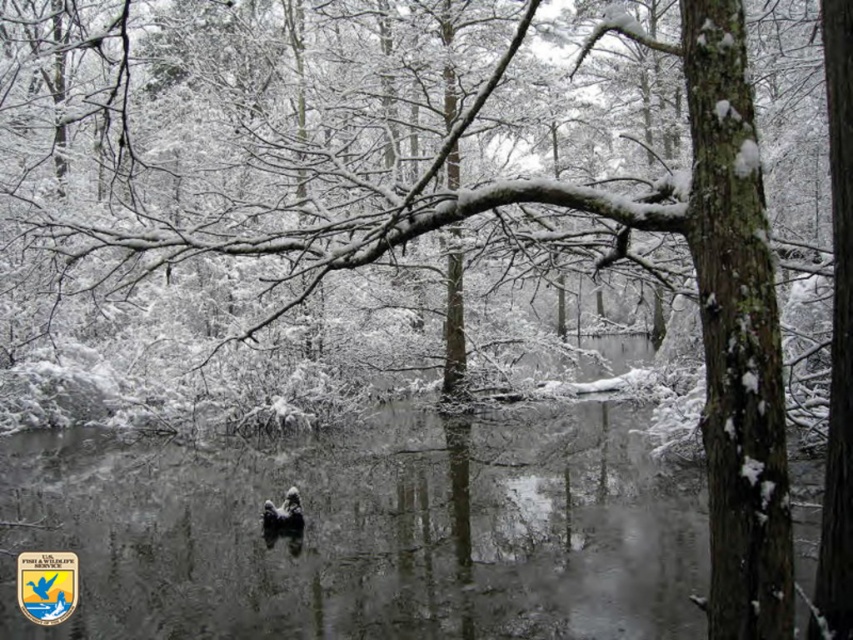
Question: Among these objects, which one is farthest from the camera?

Choices:
 (A) dark gray fur at center
 (B) clear water at center

Answer: (A)

Question: Which of the following is the farthest from the observer?

Choices:
 (A) (640, 600)
 (B) (294, 496)

Answer: (B)

Question: Is clear water at center positioned before dark gray fur at center?

Choices:
 (A) no
 (B) yes

Answer: (B)

Question: Which object appears farthest from the camera in this image?

Choices:
 (A) clear water at center
 (B) dark gray fur at center

Answer: (B)

Question: Does clear water at center appear on the left side of dark gray fur at center?

Choices:
 (A) yes
 (B) no

Answer: (B)

Question: Is clear water at center below dark gray fur at center?

Choices:
 (A) yes
 (B) no

Answer: (B)